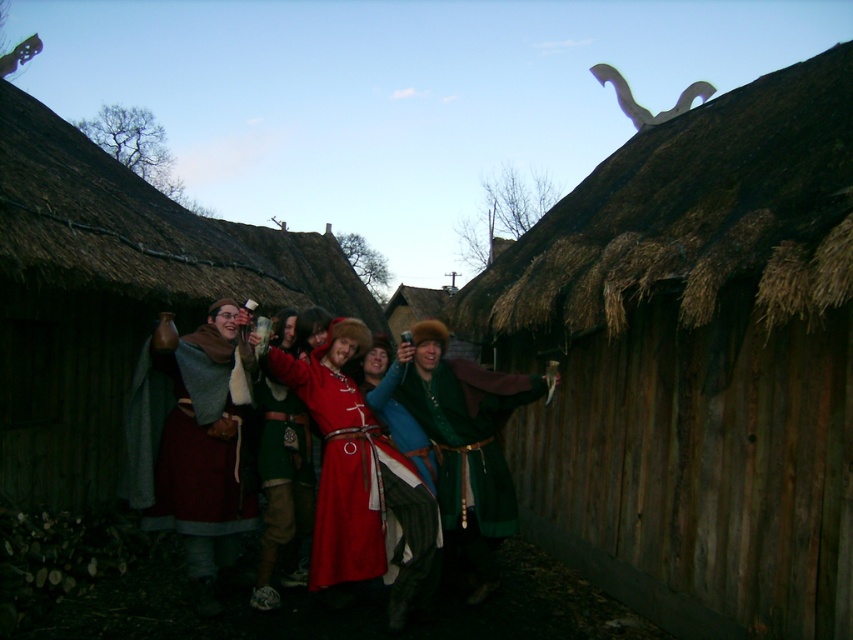
Question: Based on their relative distances, which object is farther from the thatched straw hut at center?

Choices:
 (A) velvet red cape at center
 (B) brown thatch roof at upper right

Answer: (B)

Question: Does brown thatch roof at upper right come behind matte red tunic at center?

Choices:
 (A) yes
 (B) no

Answer: (B)

Question: Does green velvet robe at center have a greater width compared to matte red tunic at center?

Choices:
 (A) yes
 (B) no

Answer: (A)

Question: Is velvet red cape at center to the left of matte red tunic at center from the viewer's perspective?

Choices:
 (A) no
 (B) yes

Answer: (B)

Question: Which point is farther to the camera?

Choices:
 (A) (222, 346)
 (B) (288, 289)
 (C) (732, 234)
 (D) (479, 499)

Answer: (B)

Question: Which of the following is the farthest from the observer?

Choices:
 (A) (840, 224)
 (B) (381, 525)
 (C) (4, 456)

Answer: (C)